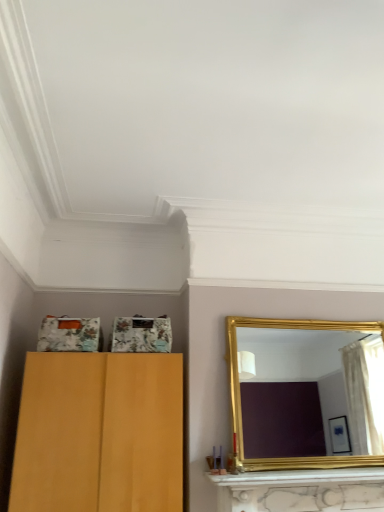
The image size is (384, 512). What do you see at coordinates (299, 477) in the screenshot? I see `gold metallic mantle at lower center` at bounding box center [299, 477].

Measure the distance between point (x=250, y=484) and camera.

Point (x=250, y=484) and camera are 2.75 meters apart.

Where is `gold metallic mantle at lower center`? gold metallic mantle at lower center is located at coordinates (299, 477).

Describe the element at coordinates (310, 396) in the screenshot. This screenshot has height=512, width=384. I see `gold-framed mirror at right` at that location.

Where is `gold-framed mirror at right`? gold-framed mirror at right is located at coordinates (310, 396).

The width and height of the screenshot is (384, 512). I want to click on gold metallic mantle at lower center, so click(x=299, y=477).

Between gold metallic mantle at lower center and gold-framed mirror at right, which one appears on the left side from the viewer's perspective?

gold metallic mantle at lower center is more to the left.

Is gold metallic mantle at lower center positioned behind gold-framed mirror at right?

No.

Which is in front, point (349, 481) or point (337, 346)?

The point (349, 481) is more forward.

From the image's perspective, is gold metallic mantle at lower center positioned above or below gold-framed mirror at right?

Based on their image positions, gold metallic mantle at lower center is located beneath gold-framed mirror at right.

From a real-world perspective, which object stands above the other?

From a 3D spatial view, gold-framed mirror at right is above.

Can you confirm if gold metallic mantle at lower center is wider than gold-framed mirror at right?

Yes, gold metallic mantle at lower center is wider than gold-framed mirror at right.

Can you confirm if gold metallic mantle at lower center is taller than gold-framed mirror at right?

No, gold metallic mantle at lower center is not taller than gold-framed mirror at right.

Who is smaller, gold metallic mantle at lower center or gold-framed mirror at right?

With smaller size is gold metallic mantle at lower center.

Is gold-framed mirror at right a part of gold metallic mantle at lower center?

No, gold-framed mirror at right is not surrounded by gold metallic mantle at lower center.

Is gold metallic mantle at lower center not close to gold-framed mirror at right?

gold metallic mantle at lower center is far away from gold-framed mirror at right.

Is gold metallic mantle at lower center looking in the opposite direction of gold-framed mirror at right?

That's right, gold metallic mantle at lower center is facing away from gold-framed mirror at right.

Measure the distance between gold metallic mantle at lower center and gold-framed mirror at right.

4.43 meters.

Find the location of a particular element. The image size is (384, 512). mirror behind the gold metallic mantle at lower center is located at coordinates (310, 396).

Is gold-framed mirror at right at the left side of gold metallic mantle at lower center?

In fact, gold-framed mirror at right is to the right of gold metallic mantle at lower center.

Relative to gold metallic mantle at lower center, is gold-framed mirror at right in front or behind?

Clearly, gold-framed mirror at right is behind gold metallic mantle at lower center.

Which is in front, point (332, 334) or point (240, 486)?

Positioned in front is point (240, 486).

From the image's perspective, is gold-framed mirror at right positioned above or below gold metallic mantle at lower center?

From the image's perspective, gold-framed mirror at right appears above gold metallic mantle at lower center.

From a real-world perspective, is gold-framed mirror at right located higher than gold metallic mantle at lower center?

Correct, in the physical world, gold-framed mirror at right is higher than gold metallic mantle at lower center.

Looking at this image, considering the relative sizes of gold-framed mirror at right and gold metallic mantle at lower center in the image provided, is gold-framed mirror at right wider than gold metallic mantle at lower center?

Incorrect, the width of gold-framed mirror at right does not surpass that of gold metallic mantle at lower center.

Consider the image. Considering the relative sizes of gold-framed mirror at right and gold metallic mantle at lower center in the image provided, is gold-framed mirror at right taller than gold metallic mantle at lower center?

Correct, gold-framed mirror at right is much taller as gold metallic mantle at lower center.

Is gold-framed mirror at right bigger or smaller than gold metallic mantle at lower center?

Considering their sizes, gold-framed mirror at right takes up more space than gold metallic mantle at lower center.

In the scene shown: Is gold-framed mirror at right outside of gold metallic mantle at lower center?

Absolutely, gold-framed mirror at right is external to gold metallic mantle at lower center.

Is gold-framed mirror at right far away from gold metallic mantle at lower center?

Indeed, gold-framed mirror at right is not near gold metallic mantle at lower center.

Is gold-framed mirror at right positioned with its back to gold metallic mantle at lower center?

No, gold-framed mirror at right is not facing away from gold metallic mantle at lower center.

Measure the distance from gold-framed mirror at right to gold metallic mantle at lower center.

gold-framed mirror at right is 4.43 meters away from gold metallic mantle at lower center.

Locate an element on the screen. The height and width of the screenshot is (512, 384). mirror above the gold metallic mantle at lower center (from a real-world perspective) is located at coordinates (310, 396).

Locate an element on the screen. This screenshot has width=384, height=512. mirror on the right of gold metallic mantle at lower center is located at coordinates (310, 396).

Locate an element on the screen. This screenshot has width=384, height=512. mantle located in front of the gold-framed mirror at right is located at coordinates (299, 477).